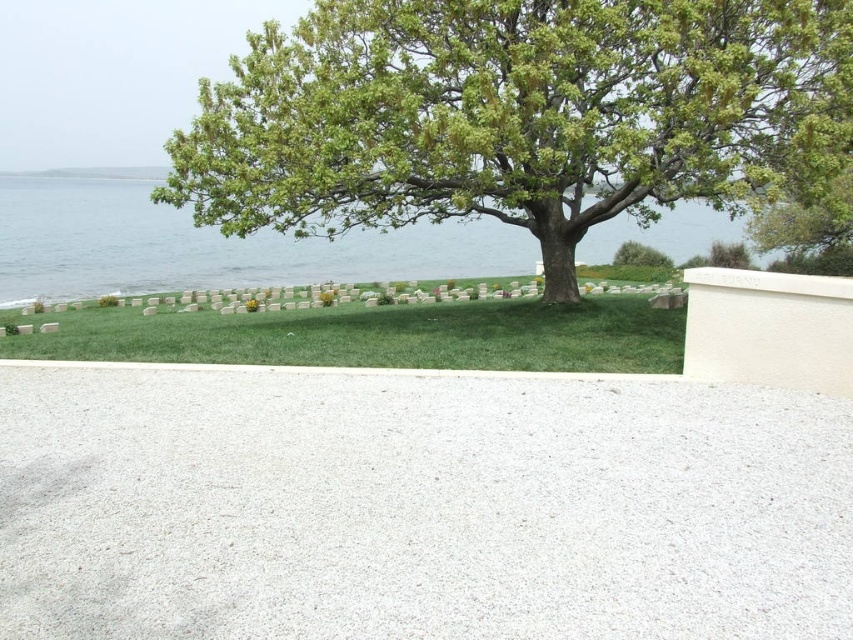
You are standing at the entrance of the cemetery and see the green leafy tree at center and the green grass at center. Which object would appear bigger to you?

The green leafy tree at center appears bigger than the green grass at center because it has a larger size compared to it.

You are standing on the gravel pathway in the cemetery and see the green leafy tree at center and the green grass at center. Which object is higher in position?

The green leafy tree at center is higher in position than the green grass at center.